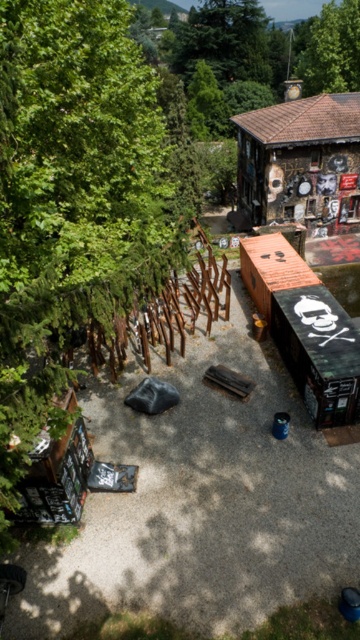
Can you confirm if green leafy tree at left is positioned above green leafy tree at upper center?

Actually, green leafy tree at left is below green leafy tree at upper center.

Does green leafy tree at left have a greater width compared to green leafy tree at upper center?

Yes.

Describe the element at coordinates (72, 198) in the screenshot. I see `green leafy tree at left` at that location.

Find the location of `green leafy tree at left`. green leafy tree at left is located at coordinates (72, 198).

Is the position of green leafy tree at left less distant than that of wooden textured hut at upper right?

Yes, it is.

Can you confirm if green leafy tree at left is shorter than wooden textured hut at upper right?

Incorrect, green leafy tree at left's height does not fall short of wooden textured hut at upper right's.

Does point (84, 109) come behind point (312, 100)?

No.

The width and height of the screenshot is (360, 640). I want to click on green leafy tree at left, so (x=72, y=198).

Between point (320, 192) and point (327, 19), which one is positioned in front?

Positioned in front is point (320, 192).

What are the coordinates of `wooden textured hut at upper right` in the screenshot? It's located at (300, 161).